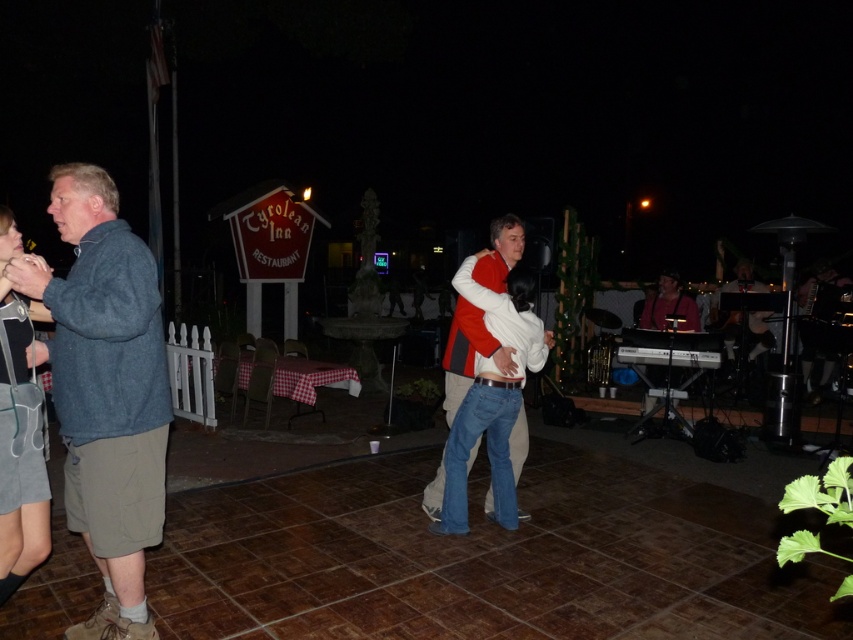
You are at the Tyrolean Inn Restaurant and need to decide which item takes up more space in your bag. You have a denim jacket at left and a gray denim skirt at lower left. Which item requires more space?

The denim jacket at left is larger in size than the gray denim skirt at lower left, so it requires more space in your bag.

You are standing at the center of the patio and want to find the gray denim skirt at lower left. Based on the coordinates provided, in which direction should you look to locate it?

The gray denim skirt at lower left is located at coordinates point (20, 513), which means it is positioned to the lower left from your current position at the center of the patio. You should look towards the lower left direction to find it.